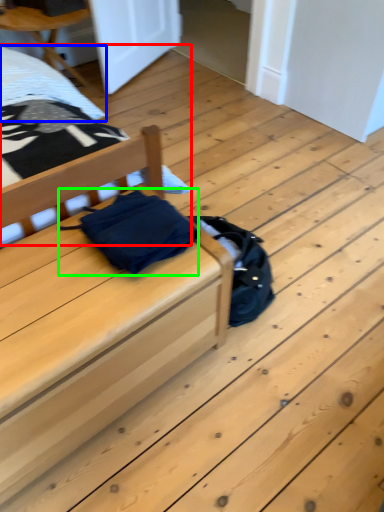
Question: Which object is positioned farthest from bed (highlighted by a red box)? Select from sheet (highlighted by a blue box) and material (highlighted by a green box).

Choices:
 (A) sheet
 (B) material

Answer: (B)